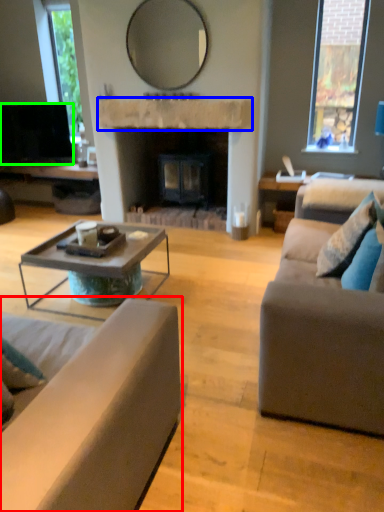
Question: Which object is positioned closest to studio couch (highlighted by a red box)? Select from mantle (highlighted by a blue box) and television (highlighted by a green box).

Choices:
 (A) mantle
 (B) television

Answer: (A)